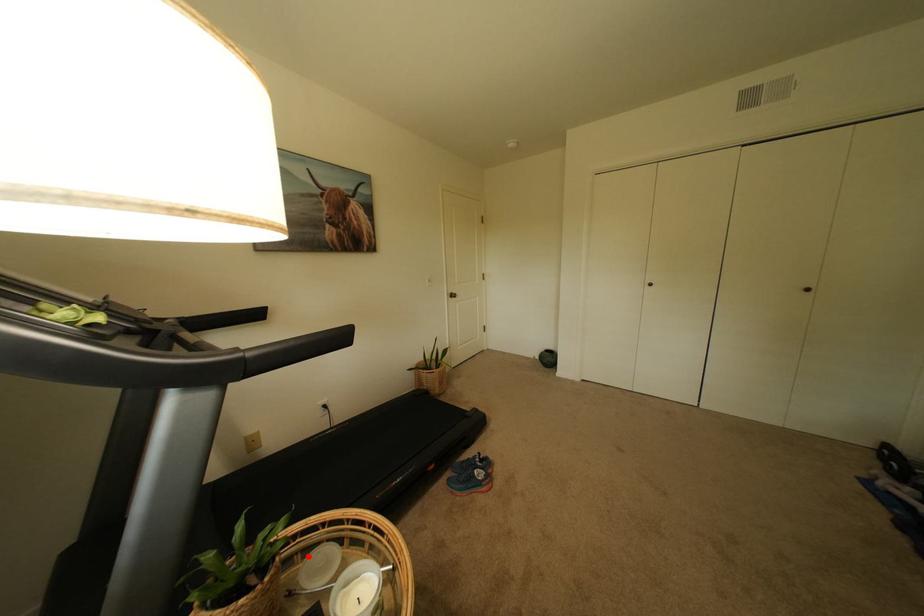
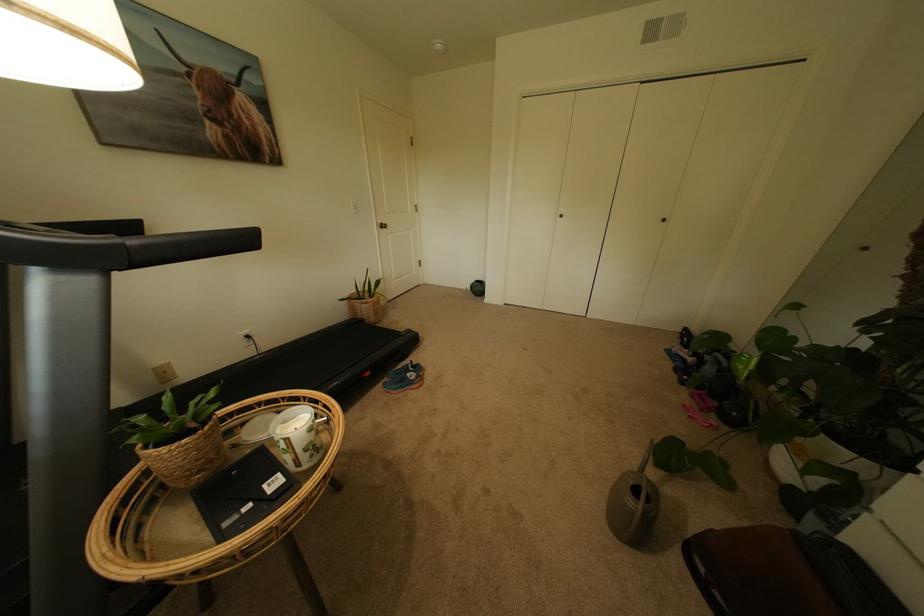
Where in the second image is the point corresponding to the highlighted location from the first image?

(248, 429)